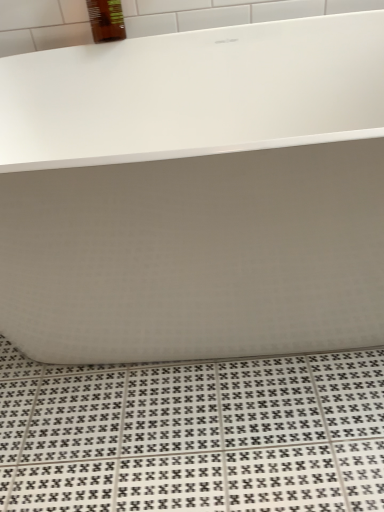
The image size is (384, 512). Find the location of `white glossy bathtub at upper center`. white glossy bathtub at upper center is located at coordinates (195, 194).

Describe the element at coordinates (195, 194) in the screenshot. The width and height of the screenshot is (384, 512). I see `white glossy bathtub at upper center` at that location.

Find the location of `white glossy bathtub at upper center`. white glossy bathtub at upper center is located at coordinates (195, 194).